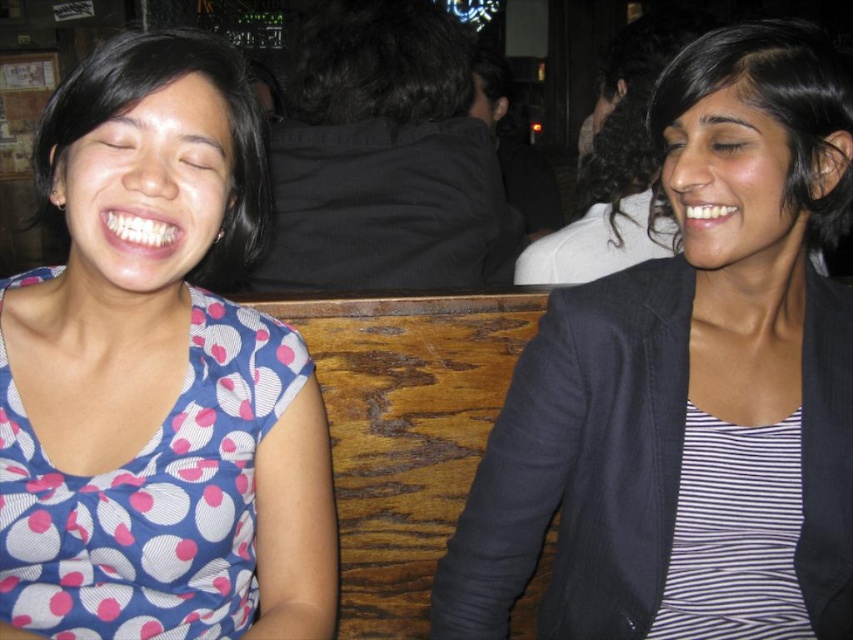
Question: Does striped fabric at center appear over blue dotted fabric shirt at left?

Choices:
 (A) yes
 (B) no

Answer: (A)

Question: Which point is closer to the camera taking this photo?

Choices:
 (A) (788, 216)
 (B) (113, 38)

Answer: (B)

Question: Does striped fabric at center have a larger size compared to blue dotted fabric shirt at left?

Choices:
 (A) no
 (B) yes

Answer: (A)

Question: Which object appears closest to the camera in this image?

Choices:
 (A) blue dotted fabric shirt at left
 (B) striped fabric at center

Answer: (A)

Question: Among these objects, which one is nearest to the camera?

Choices:
 (A) blue dotted fabric shirt at left
 (B) striped fabric at center

Answer: (A)

Question: Does striped fabric at center have a lesser width compared to blue dotted fabric shirt at left?

Choices:
 (A) yes
 (B) no

Answer: (B)